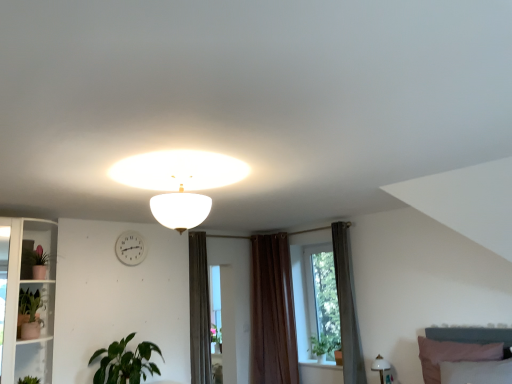
Describe the element at coordinates (125, 362) in the screenshot. I see `green matte plant at lower left, the second houseplant viewed from the top` at that location.

The image size is (512, 384). What do you see at coordinates (272, 312) in the screenshot?
I see `brown velvet curtain at center, the 2th curtain from the right` at bounding box center [272, 312].

What is the approximate width of white matte lampshade at center, which is counted as the 2th lamp, starting from the bottom?

14.73 inches.

This screenshot has width=512, height=384. What do you see at coordinates (130, 248) in the screenshot? I see `white plastic clock at upper center` at bounding box center [130, 248].

In order to click on green matte plant at lower left, the 1th houseplant in the right-to-left sequence in this screenshot , I will do `click(125, 362)`.

Which of these two, brown velvet curtain at center, the 1th curtain when ordered from back to front, or brown fabric curtain at center, which is the 1th curtain from right to left, is wider?

brown fabric curtain at center, which is the 1th curtain from right to left, is wider.

Which of these two, brown velvet curtain at center, the 2th curtain from the right, or brown fabric curtain at center, which is the second curtain from back to front, is bigger?

brown velvet curtain at center, the 2th curtain from the right.

From the image's perspective, is brown velvet curtain at center, the 1th curtain when ordered from back to front, located above or below brown fabric curtain at center, which is the second curtain in left-to-right order?

brown velvet curtain at center, the 1th curtain when ordered from back to front, is below brown fabric curtain at center, which is the second curtain in left-to-right order.

Does brown velvet curtain at center, the 2th curtain from the right, have a lesser height compared to brown fabric curtain at center, which is the second curtain in left-to-right order?

No.

Identify the location of the 1st lamp to the right when counting from the green matte plant at left, the first houseplant viewed from the left. (180, 209).

Considering the points (18, 328) and (189, 228), which point is behind, point (18, 328) or point (189, 228)?

The point (18, 328) is behind.

Is green matte plant at left, which is counted as the first houseplant, starting from the top, in contact with white matte lampshade at center, which is counted as the 2th lamp, starting from the bottom?

No, green matte plant at left, which is counted as the first houseplant, starting from the top, is not beside white matte lampshade at center, which is counted as the 2th lamp, starting from the bottom.

Is green matte plant at left, which is counted as the first houseplant, starting from the top, surrounding white matte lampshade at center, positioned as the first lamp in top-to-bottom order?

No.

Is green matte plant at lower left, the 1th houseplant in the right-to-left sequence, far from white plastic clock at upper center?

No.

From a real-world perspective, is green matte plant at lower left, the second houseplant viewed from the top, located beneath white plastic clock at upper center?

Yes, from a real-world perspective, green matte plant at lower left, the second houseplant viewed from the top, is under white plastic clock at upper center.

Visually, is green matte plant at lower left, the 1th houseplant in the right-to-left sequence, positioned to the left or to the right of white plastic clock at upper center?

In the image, green matte plant at lower left, the 1th houseplant in the right-to-left sequence, appears on the right side of white plastic clock at upper center.

Is white plastic clock at upper center completely or partially inside green matte plant at lower left, the second houseplant viewed from the top?

No, green matte plant at lower left, the second houseplant viewed from the top, does not contain white plastic clock at upper center.

From a real-world perspective, is white plastic clock at upper center positioned above or below brown velvet curtain at center, positioned as the first curtain in left-to-right order?

From a real-world perspective, white plastic clock at upper center is physically above brown velvet curtain at center, positioned as the first curtain in left-to-right order.

In the scene shown: Does white plastic clock at upper center have a larger size compared to brown velvet curtain at center, which is the second curtain in front-to-back order?

Actually, white plastic clock at upper center might be smaller than brown velvet curtain at center, which is the second curtain in front-to-back order.

From the image's perspective, which is below, white plastic clock at upper center or brown velvet curtain at center, the 2th curtain from the right?

brown velvet curtain at center, the 2th curtain from the right, from the image's perspective.

You are a GUI agent. You are given a task and a screenshot of the screen. Output one action in this format:
    pyautogui.click(x=<x>, y=<y>)
    Task: Click on the clock lying on the left of brown velvet curtain at center, the 2th curtain from the right
    
    Given the screenshot: What is the action you would take?
    pyautogui.click(x=130, y=248)

Considering the relative sizes of matte pink pot at left, marked as the second plant in a bottom-to-top arrangement, and brown fabric curtain at center, which is the second curtain from back to front, in the image provided, is matte pink pot at left, marked as the second plant in a bottom-to-top arrangement, wider than brown fabric curtain at center, which is the second curtain from back to front,?

In fact, matte pink pot at left, marked as the second plant in a bottom-to-top arrangement, might be narrower than brown fabric curtain at center, which is the second curtain from back to front.

Is matte pink pot at left, acting as the 1th plant starting from the left, in contact with brown fabric curtain at center, which is the second curtain from back to front?

matte pink pot at left, acting as the 1th plant starting from the left, is not next to brown fabric curtain at center, which is the second curtain from back to front, and they're not touching.

Is matte pink pot at left, which appears as the 2th plant when viewed from the back, at the left side of brown fabric curtain at center, which is the second curtain from back to front?

Correct, you'll find matte pink pot at left, which appears as the 2th plant when viewed from the back, to the left of brown fabric curtain at center, which is the second curtain from back to front.

Considering the sizes of objects green matte plant at left, which ranks as the 2th houseplant in right-to-left order, and white glass shelf at left in the image provided, who is taller, green matte plant at left, which ranks as the 2th houseplant in right-to-left order, or white glass shelf at left?

Standing taller between the two is white glass shelf at left.

Is green matte plant at left, which ranks as the 2th houseplant in right-to-left order, positioned with its back to white glass shelf at left?

Yes, green matte plant at left, which ranks as the 2th houseplant in right-to-left order,'s orientation is away from white glass shelf at left.

Measure the distance between green matte plant at left, the first houseplant viewed from the left, and white glass shelf at left.

They are 8.41 inches apart.

Which is closer to the camera, (37, 317) or (32, 288)?

Point (37, 317) is closer to the camera than point (32, 288).

Can you confirm if green matte plant at left, which is counted as the first houseplant, starting from the top, is bigger than brown velvet curtain at center, the 1th curtain when ordered from back to front?

Actually, green matte plant at left, which is counted as the first houseplant, starting from the top, might be smaller than brown velvet curtain at center, the 1th curtain when ordered from back to front.

Would you say brown velvet curtain at center, positioned as the first curtain in left-to-right order, is part of green matte plant at left, which ranks as the 2th houseplant in right-to-left order,'s contents?

Definitely not — brown velvet curtain at center, positioned as the first curtain in left-to-right order, is not inside green matte plant at left, which ranks as the 2th houseplant in right-to-left order.

Is point (39, 303) behind point (286, 249)?

That is False.

Where is `curtain on the left of the brown fabric curtain at center, which is the second curtain from back to front`? curtain on the left of the brown fabric curtain at center, which is the second curtain from back to front is located at coordinates (272, 312).

From the image's perspective, count 1st houseplants downward from the white matte lampshade at center, which is the first lamp from left to right, and point to it. Please provide its 2D coordinates.

[(29, 314)]

Based on their spatial positions, is white matte lampshade at center, positioned as the first lamp in top-to-bottom order, or green leafy plant at window, which is the second plant in front-to-back order, closer to white plastic clock at upper center?

white matte lampshade at center, positioned as the first lamp in top-to-bottom order, is positioned closer to the anchor white plastic clock at upper center.

From the image, which object appears to be farther from white plastic clock at upper center, dark gray wooden bed at lower right or green matte plant at left, the first houseplant viewed from the left?

The object further to white plastic clock at upper center is dark gray wooden bed at lower right.

From the picture: From the image, which object appears to be farther from brown fabric curtain at center, which is the 1th curtain from right to left, matte pink pot at left, which is the 2th plant from right to left, or white matte lampshade at center, which is counted as the 2th lamp, starting from the bottom?

Among the two, matte pink pot at left, which is the 2th plant from right to left, is located further to brown fabric curtain at center, which is the 1th curtain from right to left.

Which object lies further to the anchor point dark gray wooden bed at lower right, white plastic clock at upper center or matte pink pot at left, which appears as the first plant when viewed from the front?

matte pink pot at left, which appears as the first plant when viewed from the front, is positioned further to the anchor dark gray wooden bed at lower right.

Estimate the real-world distances between objects in this image. Which object is closer to green leafy plant at window, which is counted as the 1th plant, starting from the bottom, green matte plant at lower left, the second houseplant viewed from the top, or transparent glass window at center?

transparent glass window at center is positioned closer to the anchor green leafy plant at window, which is counted as the 1th plant, starting from the bottom.

Looking at this image, looking at the image, which one is located further to brown velvet curtain at center, positioned as the first curtain in left-to-right order, green matte plant at left, which ranks as the 2th houseplant in right-to-left order, or white glossy lamp at lower right, the first lamp from the right?

Among the two, green matte plant at left, which ranks as the 2th houseplant in right-to-left order, is located further to brown velvet curtain at center, positioned as the first curtain in left-to-right order.

From the image, which object appears to be nearer to white matte lampshade at center, positioned as the first lamp in top-to-bottom order, matte pink pot at left, acting as the 1th plant starting from the left, or brown fabric curtain at center, which is the second curtain in left-to-right order?

Among the two, matte pink pot at left, acting as the 1th plant starting from the left, is located nearer to white matte lampshade at center, positioned as the first lamp in top-to-bottom order.

Considering their positions, is green leafy plant at window, which is counted as the 1th plant, starting from the bottom, positioned closer to dark gray wooden bed at lower right than white glass shelf at left?

green leafy plant at window, which is counted as the 1th plant, starting from the bottom, is positioned closer to the anchor dark gray wooden bed at lower right.

Find the location of a particular element. shelf between white matte lampshade at center, which is the first lamp from left to right, and transparent glass window at center, along the z-axis is located at coordinates (25, 299).

Find the location of `lamp between white matte lampshade at center, which is counted as the 2th lamp, starting from the bottom, and dark gray wooden bed at lower right, in the horizontal direction`. lamp between white matte lampshade at center, which is counted as the 2th lamp, starting from the bottom, and dark gray wooden bed at lower right, in the horizontal direction is located at coordinates (380, 367).

Where is `houseplant located between matte pink pot at left, which appears as the first plant when viewed from the front, and green leafy plant at window, which is the 2th plant in top-to-bottom order, in the left-right direction`? houseplant located between matte pink pot at left, which appears as the first plant when viewed from the front, and green leafy plant at window, which is the 2th plant in top-to-bottom order, in the left-right direction is located at coordinates (125, 362).

You are a GUI agent. You are given a task and a screenshot of the screen. Output one action in this format:
    pyautogui.click(x=<x>, y=<y>)
    Task: Click on the shelf between green matte plant at left, which is counted as the first houseplant, starting from the top, and green leafy plant at window, which is the 2th plant in top-to-bottom order, from left to right
    
    Given the screenshot: What is the action you would take?
    pyautogui.click(x=25, y=299)